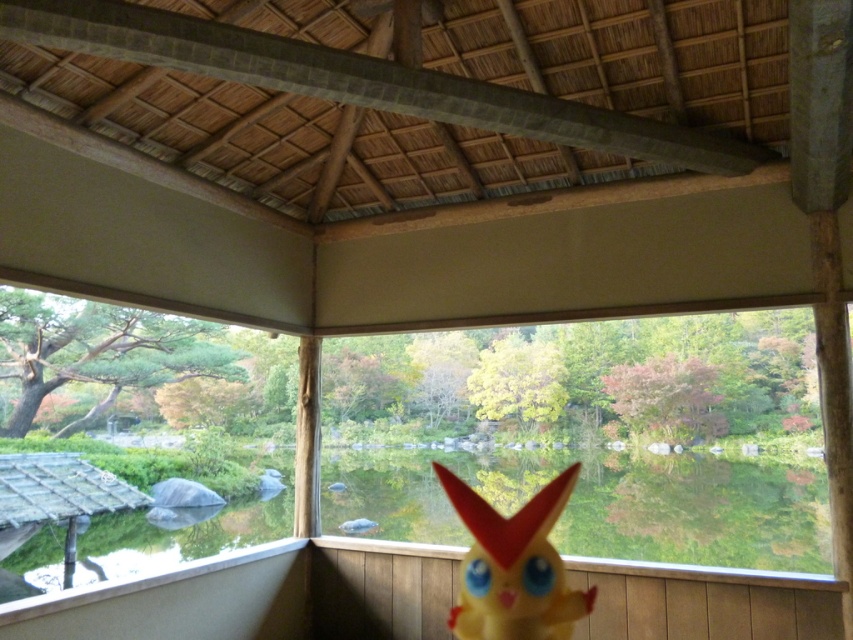
You are standing inside the traditional building and want to see the garden outside. The transparent glass window at center and the yellow rubber toy at center are both in your line of sight. Which object allows you to see the garden more clearly?

The transparent glass window at center allows you to see the garden more clearly because it is larger than the yellow rubber toy at center.